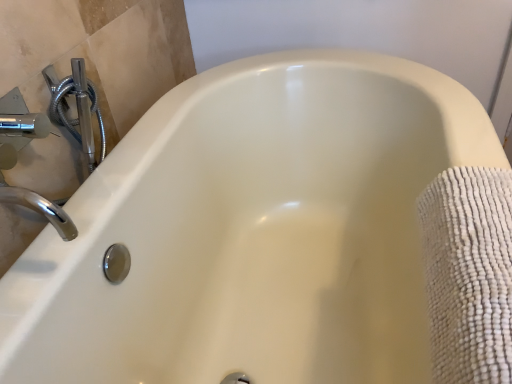
Question: Should I look upward or downward to see chrome/metallic faucet at upper left?

Choices:
 (A) down
 (B) up

Answer: (B)

Question: Is white textured towel at right facing away from chrome/metallic faucet at upper left?

Choices:
 (A) yes
 (B) no

Answer: (A)

Question: From the image's perspective, is white textured towel at right located beneath chrome/metallic faucet at upper left?

Choices:
 (A) yes
 (B) no

Answer: (A)

Question: Is white textured towel at right positioned in front of chrome/metallic faucet at upper left?

Choices:
 (A) yes
 (B) no

Answer: (A)

Question: Is white textured towel at right bigger than chrome/metallic faucet at upper left?

Choices:
 (A) yes
 (B) no

Answer: (A)

Question: From a real-world perspective, is white textured towel at right beneath chrome/metallic faucet at upper left?

Choices:
 (A) yes
 (B) no

Answer: (A)

Question: From the image's perspective, would you say white textured towel at right is positioned over chrome/metallic faucet at upper left?

Choices:
 (A) no
 (B) yes

Answer: (A)

Question: Does chrome/metallic faucet at upper left have a greater height compared to white textured towel at right?

Choices:
 (A) no
 (B) yes

Answer: (A)

Question: From the image's perspective, is chrome/metallic faucet at upper left on white textured towel at right?

Choices:
 (A) yes
 (B) no

Answer: (A)

Question: Are chrome/metallic faucet at upper left and white textured towel at right beside each other?

Choices:
 (A) no
 (B) yes

Answer: (A)

Question: Is chrome/metallic faucet at upper left wider than white textured towel at right?

Choices:
 (A) yes
 (B) no

Answer: (B)

Question: Does chrome/metallic faucet at upper left appear on the right side of white textured towel at right?

Choices:
 (A) no
 (B) yes

Answer: (A)

Question: Is white textured towel at right completely or partially inside chrome/metallic faucet at upper left?

Choices:
 (A) yes
 (B) no

Answer: (B)

Question: Considering their positions, is white textured towel at right located in front of or behind chrome/metallic faucet at upper left?

Choices:
 (A) front
 (B) behind

Answer: (A)